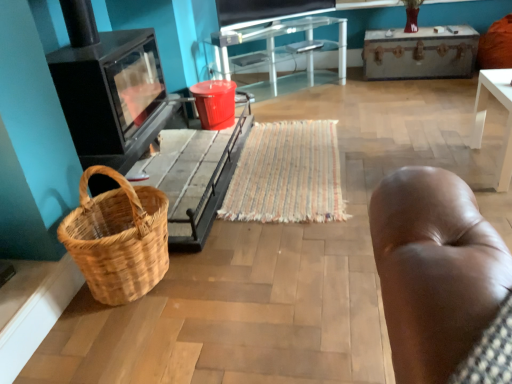
Question: Is matte black television at upper center inside the boundaries of brown woven picnic basket at lower left, or outside?

Choices:
 (A) outside
 (B) inside

Answer: (A)

Question: Based on their positions, is matte black television at upper center located to the left or right of brown woven picnic basket at lower left?

Choices:
 (A) right
 (B) left

Answer: (A)

Question: Which object is positioned farthest from the black glass stove at left?

Choices:
 (A) brown woven picnic basket at lower left
 (B) woven wood basket at lower left, marked as the 1th table in a front-to-back arrangement
 (C) matte black television at upper center
 (D) transparent glass table at center
 (E) red plastic bucket at center

Answer: (C)

Question: Estimate the real-world distances between objects in this image. Which object is farther from the red plastic bucket at center?

Choices:
 (A) transparent glass table at center
 (B) matte black television at upper center
 (C) black glass stove at left
 (D) wooden trunk at upper right, acting as the second table starting from the bottom
 (E) brown woven picnic basket at lower left

Answer: (D)